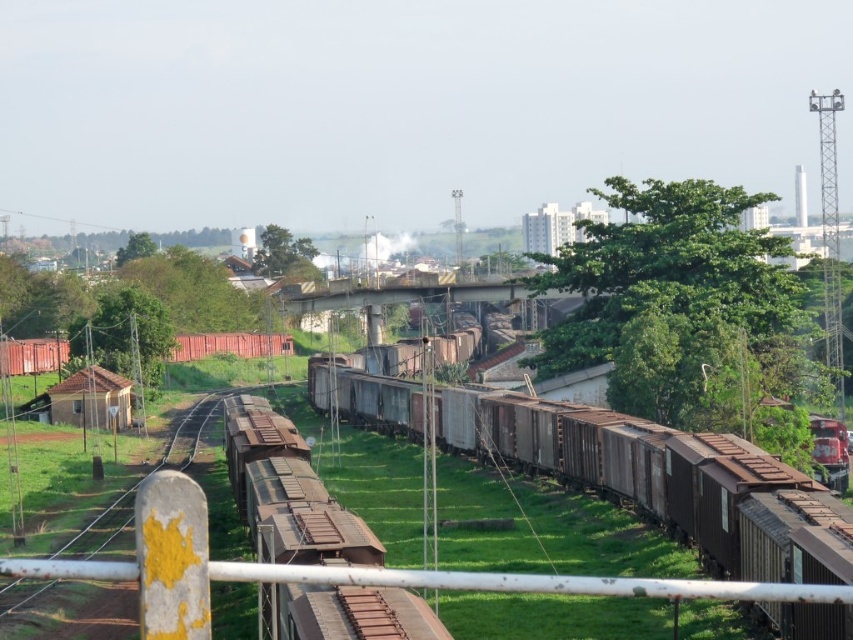
You are standing at the metal railing with a yellow post and want to walk towards the cluster of buildings and utility poles. There are two points marked on your path. Which point should you reach first, point [334,545] or point [303,264]?

You should reach point [334,545] first because it is in front of point [303,264] along your path towards the cluster of buildings and utility poles.

You are a maintenance worker checking the railway. You notice the rusty metal train carriages at center and the rusty metal rail at center. Which one is positioned higher in the image?

The rusty metal train carriages at center are positioned above the rusty metal rail at center, so they are higher in the image.

You are a painter standing at the metal railing with a yellow post. You want to paint both the rusty metal train car at center and the green leafy tree at upper center. Which object should you paint first if you want to start with the narrower one?

The rusty metal train car at center is thinner than the green leafy tree at upper center, so you should paint the rusty metal train car at center first since it is narrower.